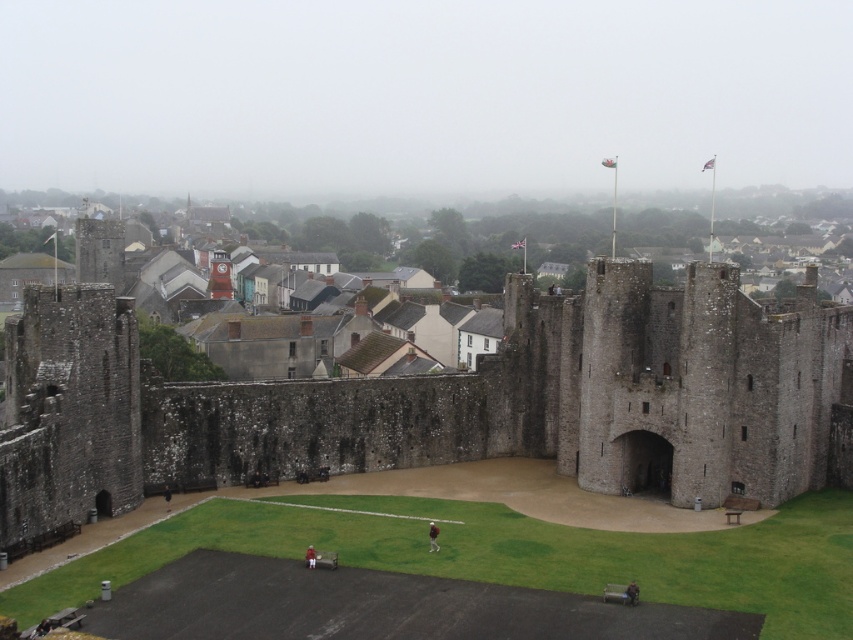
Question: Which point is farther from the camera taking this photo?

Choices:
 (A) (306, 552)
 (B) (625, 588)
 (C) (169, 506)
 (D) (428, 532)

Answer: (C)

Question: Which point is farther to the camera?

Choices:
 (A) (635, 588)
 (B) (163, 496)

Answer: (B)

Question: Is dark gray stone castle at center closer to the viewer compared to dark brown leather jacket at lower center?

Choices:
 (A) no
 (B) yes

Answer: (B)

Question: Is red brick clock tower at center further to camera compared to green fabric jacket at lower center?

Choices:
 (A) no
 (B) yes

Answer: (B)

Question: Is green fabric jacket at lower center bigger than red shirt at center?

Choices:
 (A) no
 (B) yes

Answer: (B)

Question: Which of the following is the closest to the observer?

Choices:
 (A) (169, 499)
 (B) (311, 548)
 (C) (635, 595)
 (D) (229, 264)

Answer: (C)